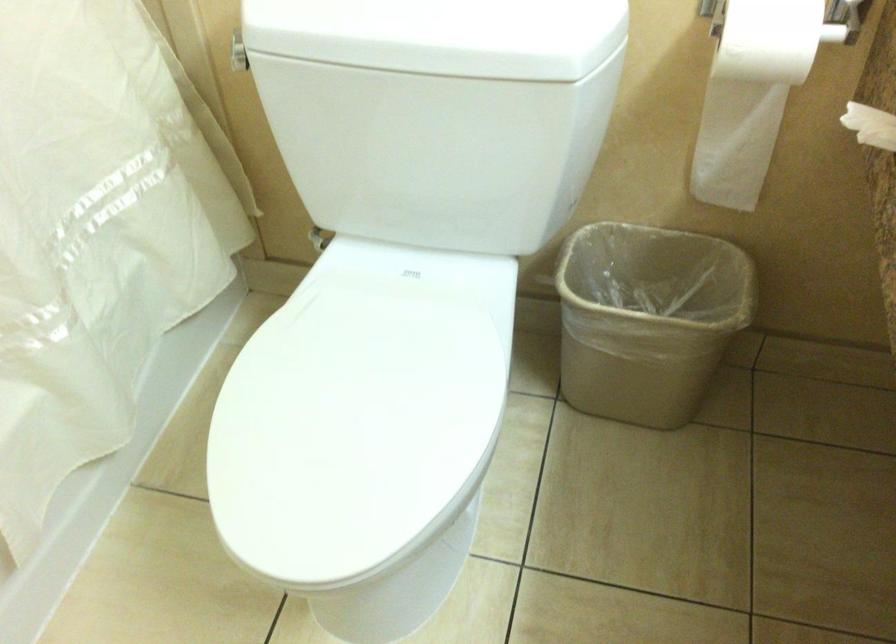
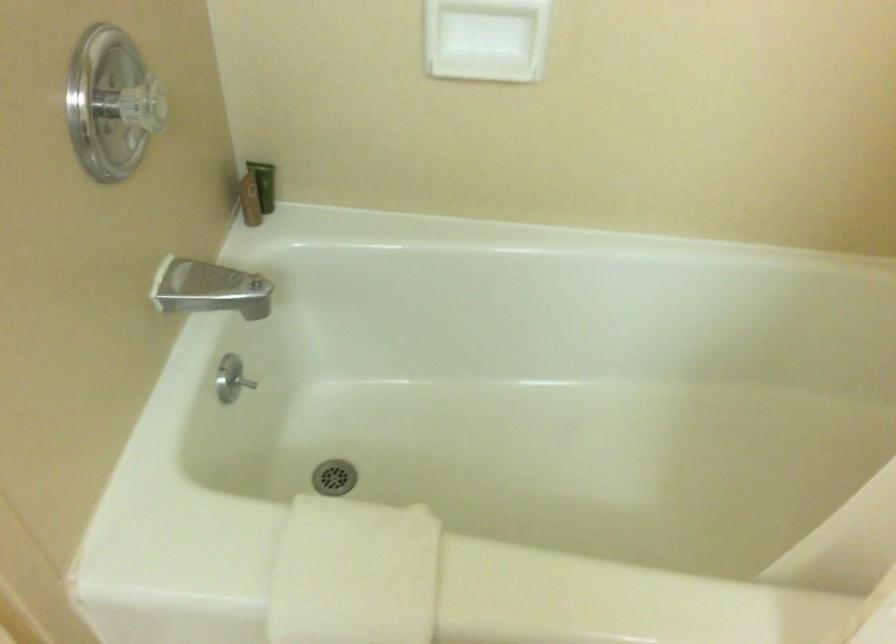
Based on the continuous images, in which direction is the camera rotating?

The camera rotated toward left-down.